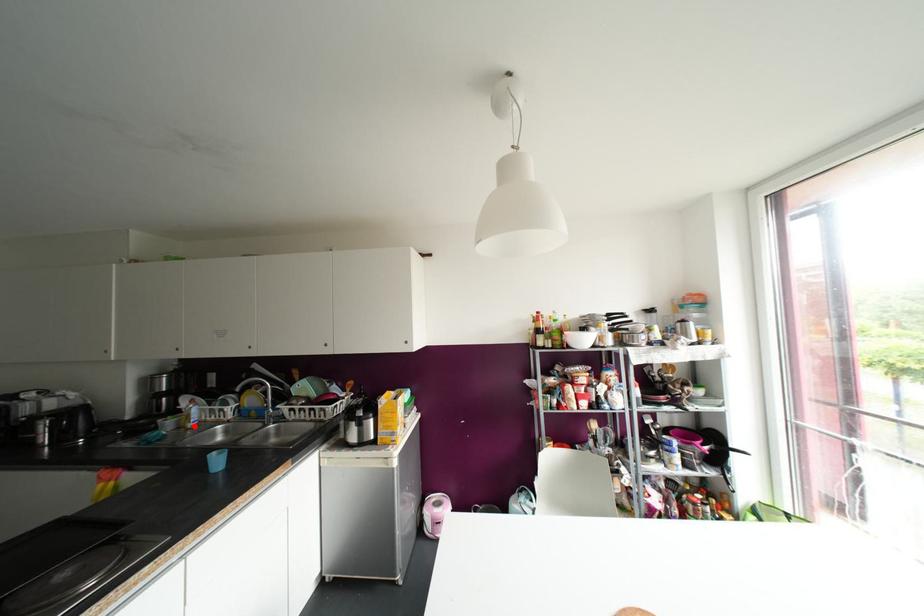
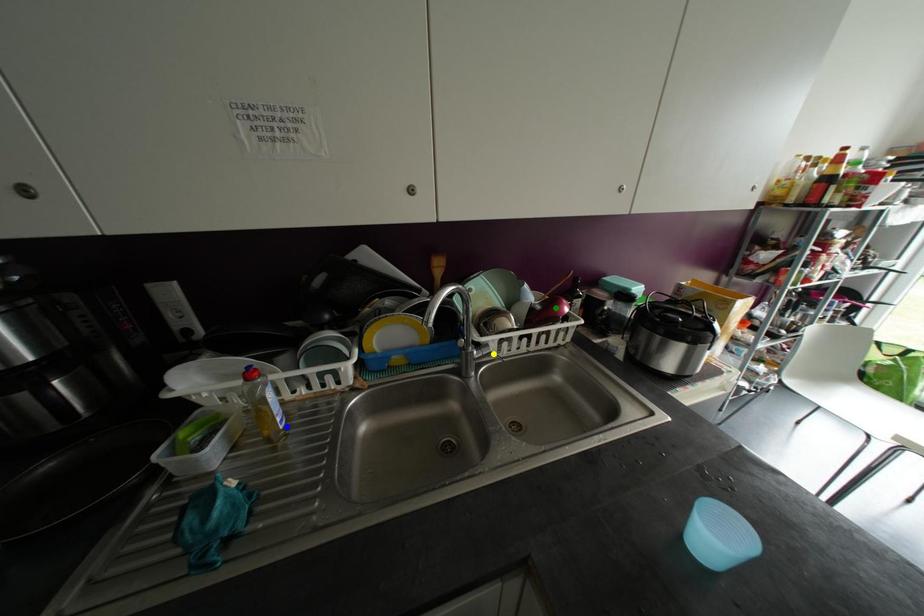
Question: I am providing you with two images of the same scene from different viewpoints. A red point is marked on the first image. You are given multiple points on the second image. Can you choose the point in image 2 that corresponds to the point in image 1?

Choices:
 (A) green point
 (B) yellow point
 (C) blue point

Answer: (C)